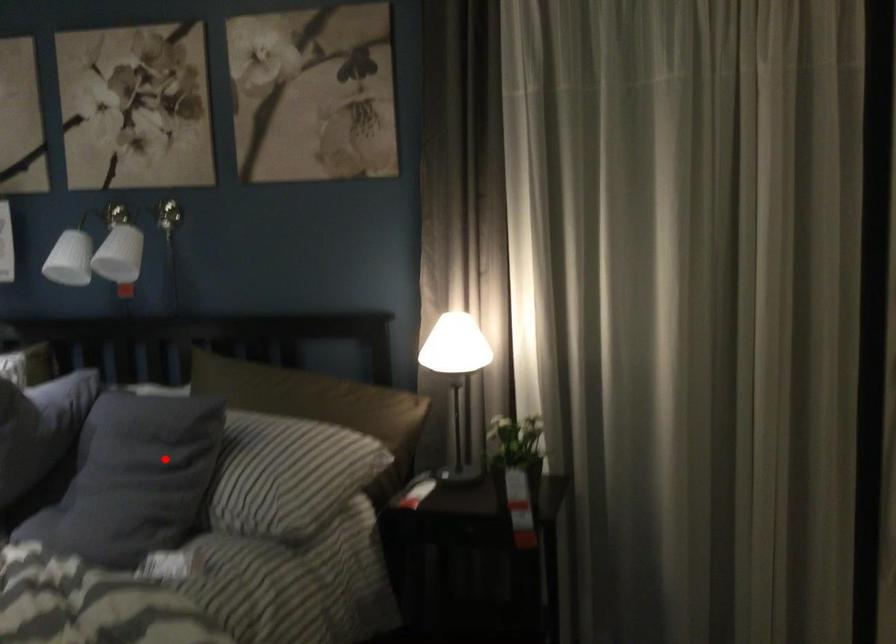
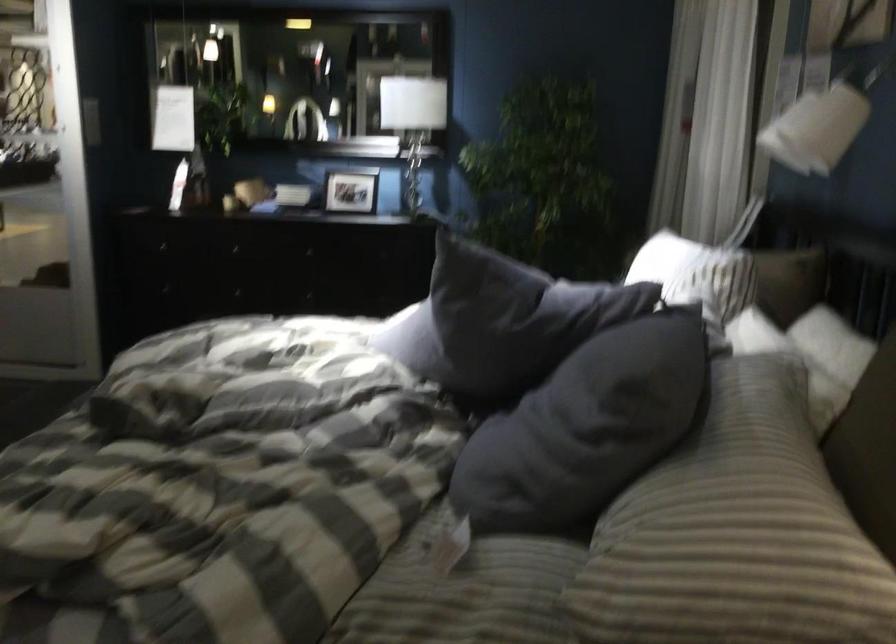
Locate, in the second image, the point that corresponds to the highlighted location in the first image.

(596, 415)